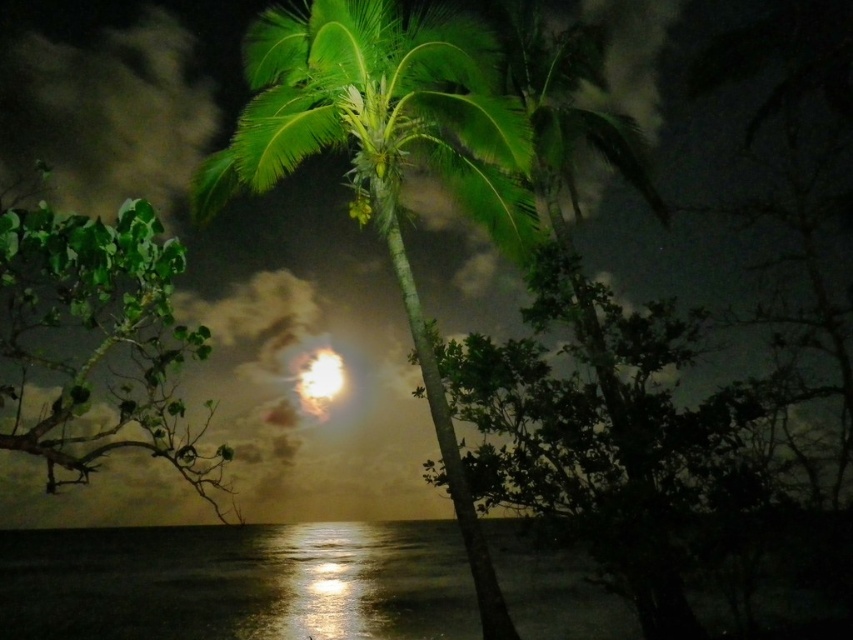
Question: Which object is farther from the camera taking this photo?

Choices:
 (A) green leafy branch at left
 (B) green leafy coconut tree at center
 (C) bright white orb at center

Answer: (C)

Question: Which point appears closest to the camera in this image?

Choices:
 (A) (389, 227)
 (B) (305, 387)

Answer: (A)

Question: Is green leafy branch at left thinner than bright white orb at center?

Choices:
 (A) yes
 (B) no

Answer: (B)

Question: In this image, where is green leafy coconut tree at center located relative to bright white orb at center?

Choices:
 (A) right
 (B) left

Answer: (A)

Question: Based on their relative distances, which object is farther from the green leafy branch at left?

Choices:
 (A) bright white orb at center
 (B) green leafy coconut tree at center

Answer: (A)

Question: Can you confirm if green leafy branch at left is bigger than bright white orb at center?

Choices:
 (A) yes
 (B) no

Answer: (A)